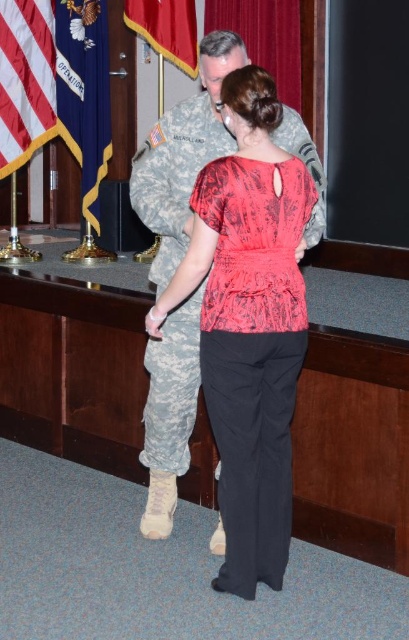
Can you confirm if american flag at left is smaller than red velvet flag at upper left?

Incorrect, american flag at left is not smaller in size than red velvet flag at upper left.

Who is positioned more to the left, american flag at left or red velvet flag at upper left?

american flag at left is more to the left.

This screenshot has height=640, width=409. What are the coordinates of `american flag at left` in the screenshot? It's located at (26, 81).

Is blue fabric flag at left wider than american flag at left?

No.

Is point (87, 81) positioned before point (22, 49)?

No, (87, 81) is behind (22, 49).

You are a GUI agent. You are given a task and a screenshot of the screen. Output one action in this format:
    pyautogui.click(x=<x>, y=<y>)
    Task: Click on the blue fabric flag at left
    The height and width of the screenshot is (640, 409).
    Given the screenshot: What is the action you would take?
    pyautogui.click(x=83, y=92)

Is matte red blouse at center positioned behind red velvet flag at upper left?

No, it is in front of red velvet flag at upper left.

Locate an element on the screen. This screenshot has height=640, width=409. matte red blouse at center is located at coordinates (249, 324).